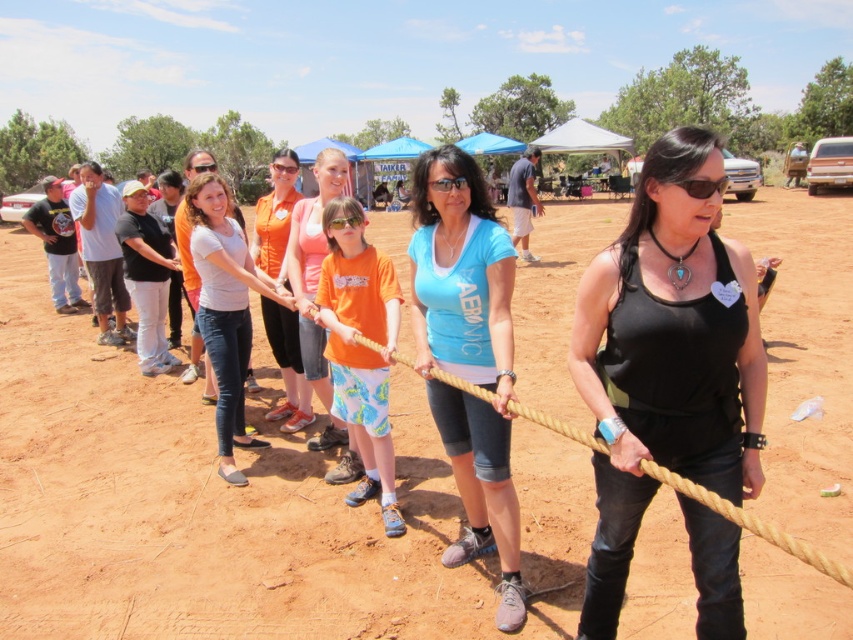
Which is below, matte blue t-shirt at center or white cotton shirt at center?

matte blue t-shirt at center

Can you confirm if matte blue t-shirt at center is bigger than white cotton shirt at center?

Yes.

Between point (444, 392) and point (204, 232), which one is positioned behind?

The point (204, 232) is behind.

The image size is (853, 640). What are the coordinates of `matte blue t-shirt at center` in the screenshot? It's located at (468, 355).

Between white cotton shirt at center and orange fabric shirt at center, which one appears on the left side from the viewer's perspective?

white cotton shirt at center is more to the left.

Does white cotton shirt at center have a greater height compared to orange fabric shirt at center?

No.

Locate an element on the screen. white cotton shirt at center is located at coordinates (225, 308).

Can you confirm if white cotton shirt at center is smaller than orange cotton shirt at center?

No, white cotton shirt at center is not smaller than orange cotton shirt at center.

Does white cotton shirt at center appear over orange cotton shirt at center?

Actually, white cotton shirt at center is below orange cotton shirt at center.

This screenshot has height=640, width=853. I want to click on white cotton shirt at center, so click(x=225, y=308).

Where is `white cotton shirt at center`? This screenshot has width=853, height=640. white cotton shirt at center is located at coordinates (225, 308).